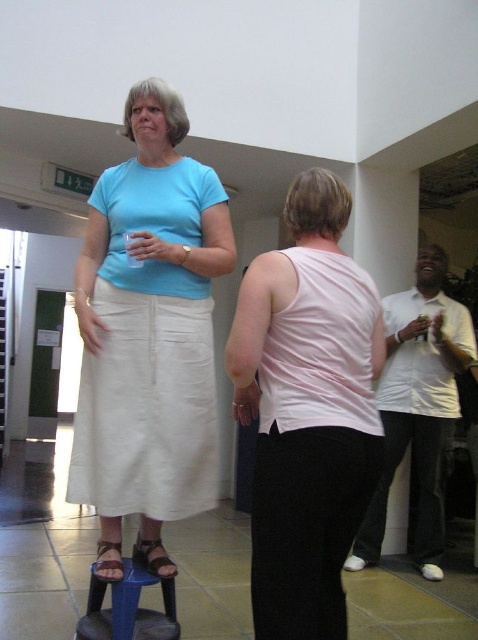
Question: Which point is closer to the camera taking this photo?

Choices:
 (A) (173, 572)
 (B) (115, 577)
 (C) (175, 467)

Answer: (B)

Question: From the image, what is the correct spatial relationship of white matte cup at right in relation to blue fabric stool at lower left?

Choices:
 (A) below
 (B) above

Answer: (B)

Question: Which object is the closest to the white matte cup at right?

Choices:
 (A) brown leather sandal at lower left
 (B) blue fabric stool at lower left
 (C) matte cotton skirt at center
 (D) leather sandal at lower center

Answer: (B)

Question: Among these points, which one is nearest to the camera?

Choices:
 (A) (347, 563)
 (B) (106, 637)
 (C) (304, 385)
 (D) (119, 557)

Answer: (C)

Question: Can you confirm if pink fabric tank top at center is positioned below white matte cup at right?

Choices:
 (A) no
 (B) yes

Answer: (A)

Question: From the image, what is the correct spatial relationship of matte cotton skirt at center in relation to leather sandal at lower center?

Choices:
 (A) below
 (B) above

Answer: (B)